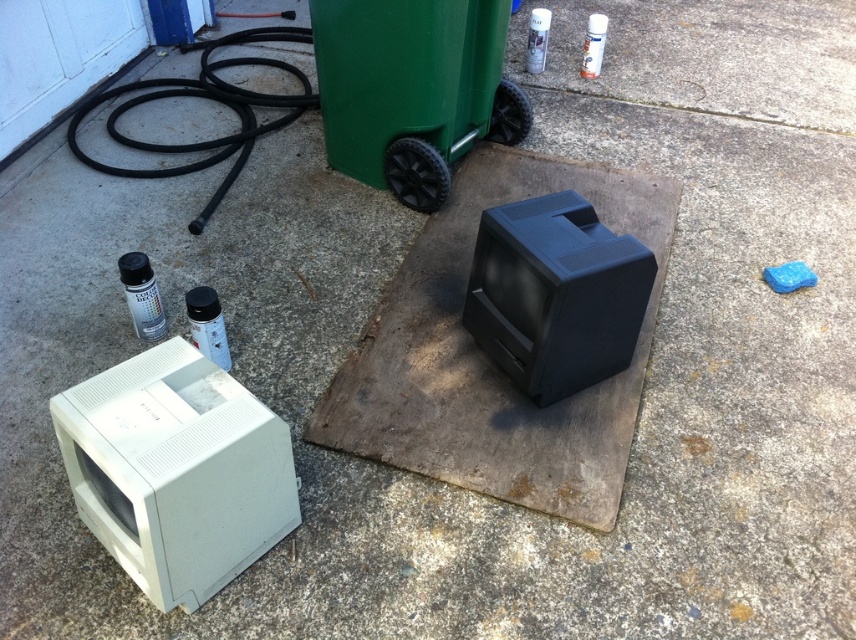
Based on the photo, can you confirm if green plastic recycling bin at center is positioned below metallic spray can at lower left?

Actually, green plastic recycling bin at center is above metallic spray can at lower left.

From the picture: Does green plastic recycling bin at center appear over metallic spray can at lower left?

Yes, green plastic recycling bin at center is above metallic spray can at lower left.

Which is behind, point (421, 134) or point (199, 342)?

Positioned behind is point (421, 134).

Locate an element on the screen. green plastic recycling bin at center is located at coordinates (412, 90).

Is point (135, 364) behind point (535, 65)?

No.

Does white plastic monitor at lower left appear over glossy plastic spray can at upper center?

A: Actually, white plastic monitor at lower left is below glossy plastic spray can at upper center.

The image size is (856, 640). What are the coordinates of `white plastic monitor at lower left` in the screenshot? It's located at (176, 472).

Who is positioned more to the right, white plastic monitor at lower left or matte black spray can at lower left?

From the viewer's perspective, white plastic monitor at lower left appears more on the right side.

Can you confirm if white plastic monitor at lower left is bigger than matte black spray can at lower left?

Indeed, white plastic monitor at lower left has a larger size compared to matte black spray can at lower left.

Does point (207, 440) lie in front of point (161, 323)?

That is True.

Where is `white plastic monitor at lower left`? The width and height of the screenshot is (856, 640). white plastic monitor at lower left is located at coordinates (176, 472).